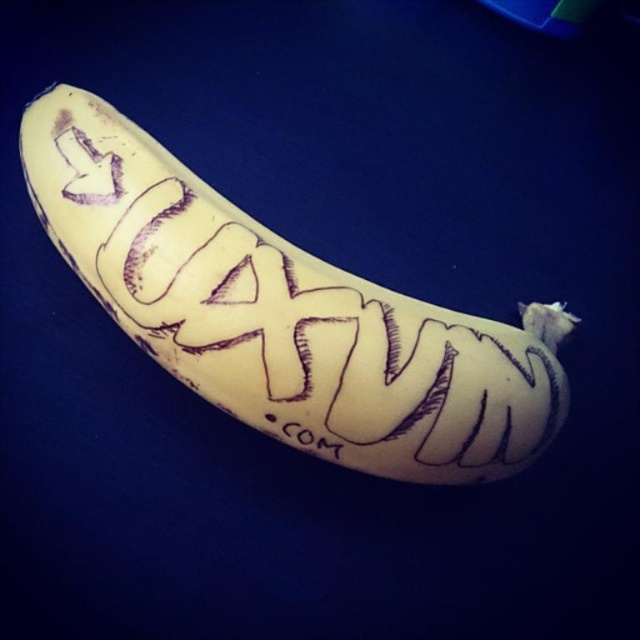
How far apart are yellow matte banana at center and black ink text at center?

yellow matte banana at center is 9.99 inches from black ink text at center.

Between yellow matte banana at center and black ink text at center, which one appears on the right side from the viewer's perspective?

From the viewer's perspective, black ink text at center appears more on the right side.

Image resolution: width=640 pixels, height=640 pixels. I want to click on yellow matte banana at center, so click(x=282, y=312).

You are a GUI agent. You are given a task and a screenshot of the screen. Output one action in this format:
    pyautogui.click(x=<x>, y=<y>)
    Task: Click on the yellow matte banana at center
    
    Given the screenshot: What is the action you would take?
    pyautogui.click(x=282, y=312)